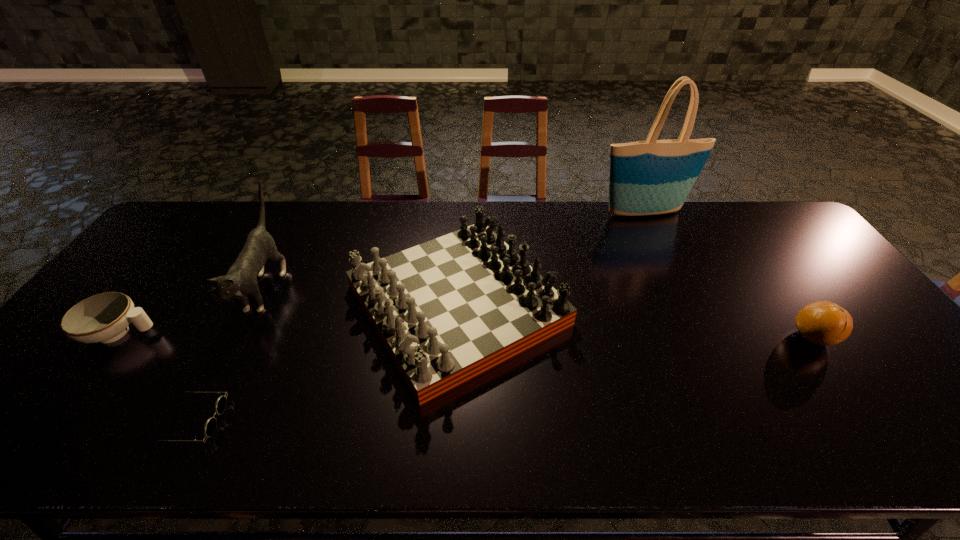
This screenshot has height=540, width=960. Find the location of `vacant area situated 0.210m on the right of the farthest object`. vacant area situated 0.210m on the right of the farthest object is located at coordinates (750, 213).

I want to click on free spot located 0.150m at the face of the cat, so click(216, 384).

I want to click on vacant space situated on the back of the third object from right to left, so click(462, 216).

The width and height of the screenshot is (960, 540). Identify the location of vacant space located 0.140m on the back of the rightmost object. (776, 285).

Image resolution: width=960 pixels, height=540 pixels. What are the coordinates of `free space located on the side with the handle of the leftmost object` in the screenshot? It's located at (310, 333).

Find the location of a particular element. This screenshot has width=960, height=540. vacant space located 0.400m on the front-facing side of the sunglasses is located at coordinates (403, 421).

What are the coordinates of `tote bag at the far edge` in the screenshot? It's located at (651, 177).

The image size is (960, 540). Find the location of `gameboard situated at the far edge`. gameboard situated at the far edge is located at coordinates (446, 310).

You are a GUI agent. You are given a task and a screenshot of the screen. Output one action in this format:
    pyautogui.click(x=<x>, y=<y>)
    Task: Click on the object at the near edge
    This screenshot has height=540, width=960.
    Given the screenshot: What is the action you would take?
    pyautogui.click(x=210, y=426)

Identify the location of object that is at the left edge. The height and width of the screenshot is (540, 960). (104, 318).